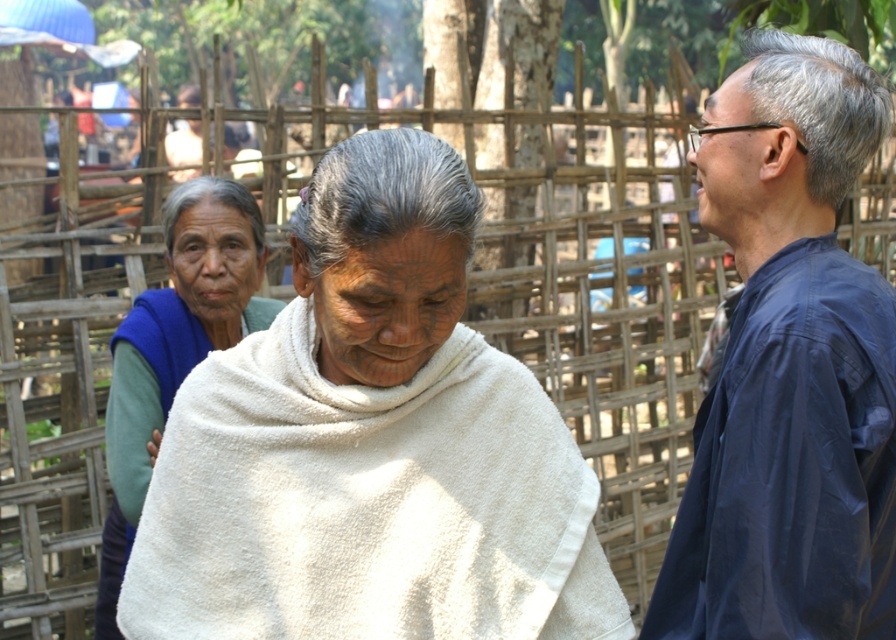
You are a photographer setting up a shot in this rural scene. You need to position a small tripod between the white soft cloth at center and the blue fabric shirt at right. Since the tripod is 1 meter tall, will it fit vertically between them without exceeding the height of either object?

The white soft cloth at center has a lesser height compared to blue fabric shirt at right. Since the tripod is 1 meter tall, it may exceed the height of the white soft cloth at center but not the blue fabric shirt at right. Therefore, the tripod might not fit vertically between them without being taller than the white soft cloth at center.

You are a photographer setting up a shot in this scene. You have a camera with a limited focus area. The focus area can only cover the space taken by the white soft cloth at center. Will the blue fleece vest at left fit entirely within this focus area?

The white soft cloth at center occupies less space than the blue fleece vest at left. Since the focus area can only cover the space of the white soft cloth at center, the blue fleece vest at left will not fit entirely within this focus area.